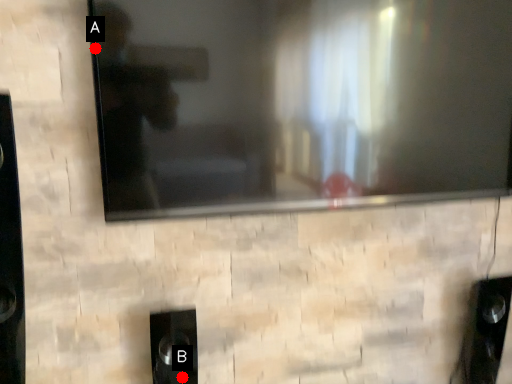
Question: Two points are circled on the image, labeled by A and B beside each circle. Which point is closer to the camera?

Choices:
 (A) A is closer
 (B) B is closer

Answer: (A)